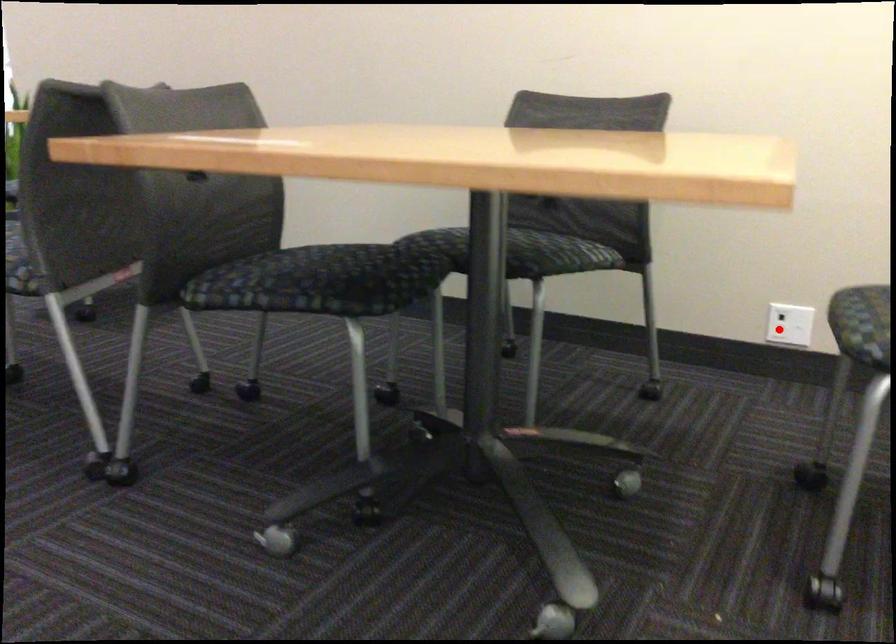
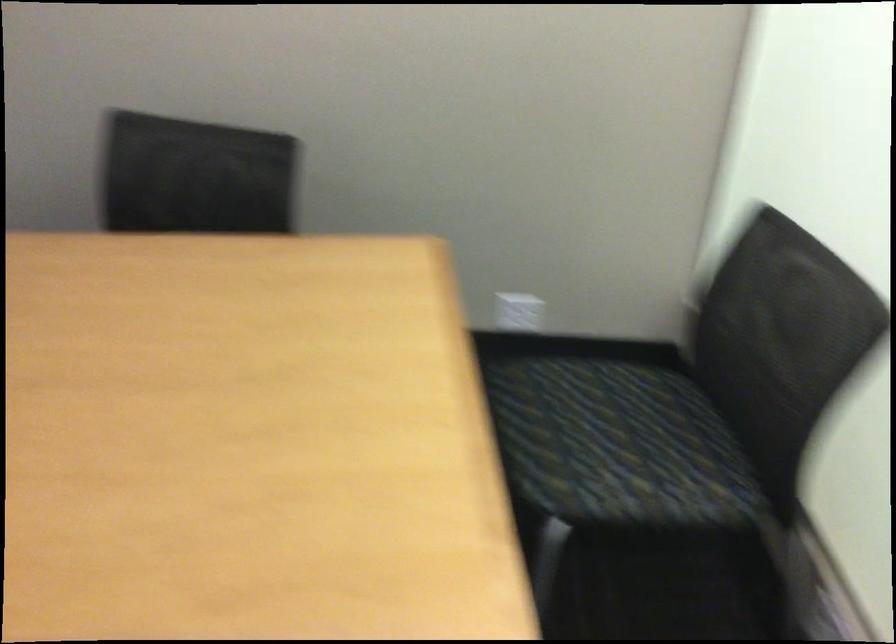
Question: I am providing you with two images of the same scene from different viewpoints. A red point is marked on the first image. Can you still see the location of the red point in image 2?

Choices:
 (A) Yes
 (B) No

Answer: (B)